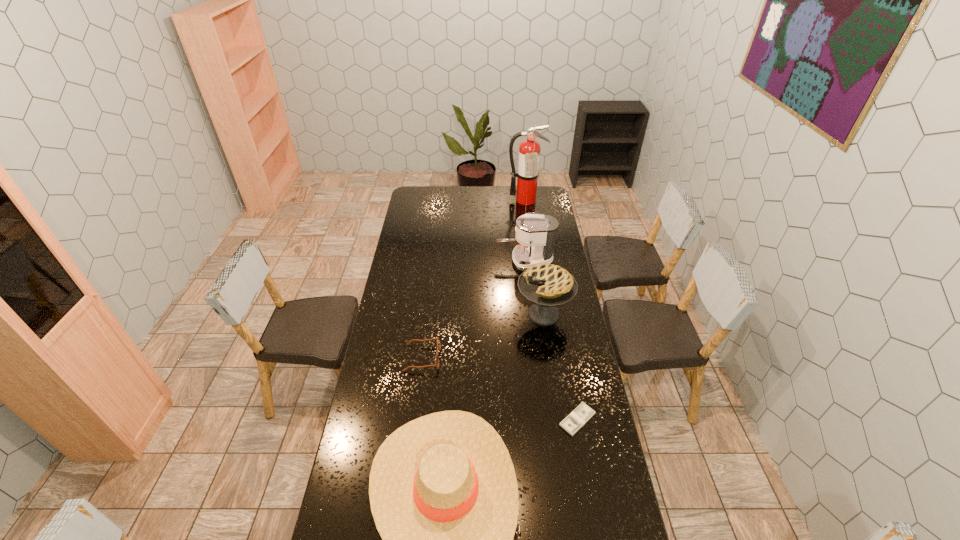
Identify the location of vacant space located 0.120m on the front-facing side of the fifth nearest object. (472, 261).

You are a GUI agent. You are given a task and a screenshot of the screen. Output one action in this format:
    pyautogui.click(x=<x>, y=<y>)
    Task: Click on the free point located on the cut side of the pie
    The image size is (960, 540).
    Given the screenshot: What is the action you would take?
    pyautogui.click(x=463, y=314)

Find the location of `free space located on the cut side of the pie`. free space located on the cut side of the pie is located at coordinates (456, 314).

I want to click on free spot located on the cut side of the pie, so 482,314.

Find the location of `vacant region located 0.080m on the front-facing side of the fifth tallest object`. vacant region located 0.080m on the front-facing side of the fifth tallest object is located at coordinates [460, 357].

Where is `vacant space located 0.060m on the back of the shortest object`? The image size is (960, 540). vacant space located 0.060m on the back of the shortest object is located at coordinates (572, 390).

Where is `object that is at the far edge`? The image size is (960, 540). object that is at the far edge is located at coordinates (527, 174).

Find the location of a particular element. object that is positioned at the left edge is located at coordinates (438, 339).

This screenshot has height=540, width=960. I want to click on fire extinguisher that is at the right edge, so click(x=527, y=174).

Where is `coffee maker situated at the right edge`? coffee maker situated at the right edge is located at coordinates (536, 233).